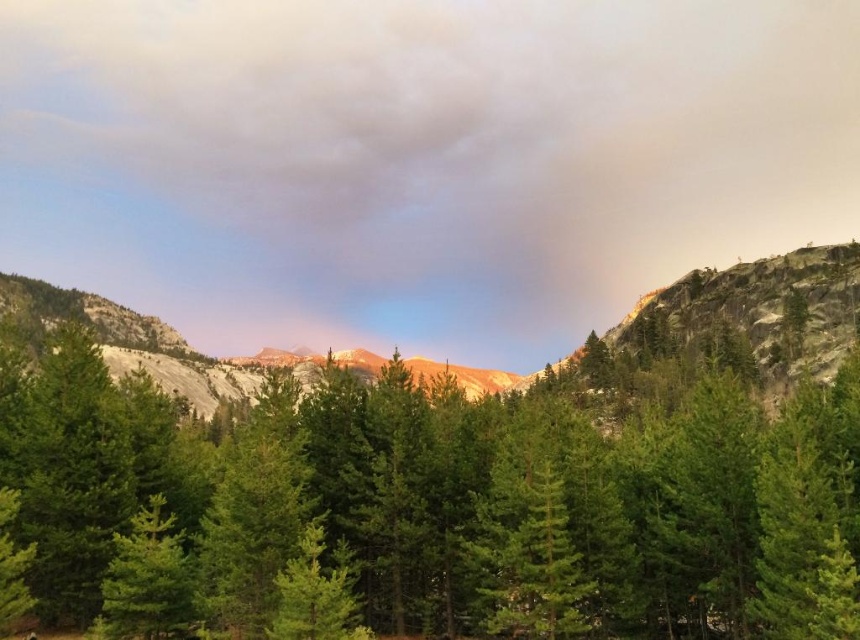
You are a hiker planning to take a photo of the green matte tree at center and the rugged granite mountain at center. Which object should you focus on first if you want to capture both in a single frame without moving your camera?

The green matte tree at center is smaller than the rugged granite mountain at center, so you should focus on the rugged granite mountain at center first since it is larger and will occupy more of the frame.

You are an airplane passenger looking out the window and see the smokey gray cloud at upper center and the green matte tree at center. Which object is closer to the airplane?

The smokey gray cloud at upper center is closer to the airplane because the green matte tree at center is behind it.

You are standing in the mountainous landscape and want to move from the point at coordinates point (x=387, y=147) to the point at coordinates point (x=424, y=426). Which direction should you face to walk towards the second point?

You should face towards the right direction because point (x=424, y=426) is located to the right of point (x=387, y=147).